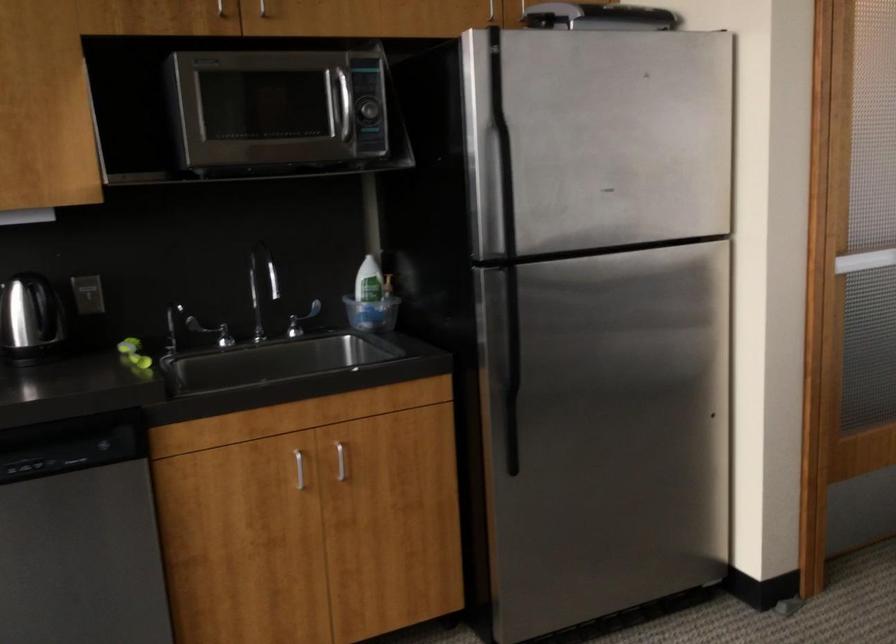
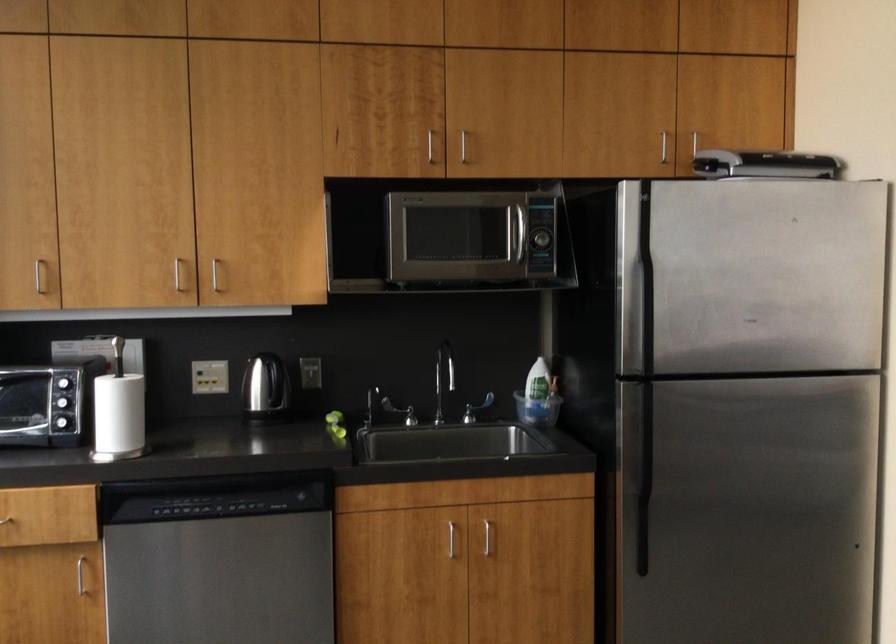
Find the pixel in the second image that matches the point at 366,292 in the first image.

(539, 391)